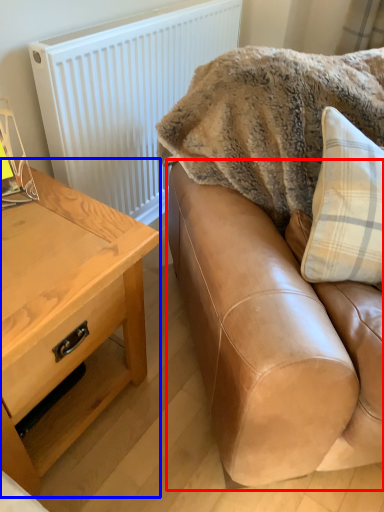
Question: Which object is closer to the camera taking this photo, studio couch (highlighted by a red box) or table (highlighted by a blue box)?

Choices:
 (A) studio couch
 (B) table

Answer: (A)